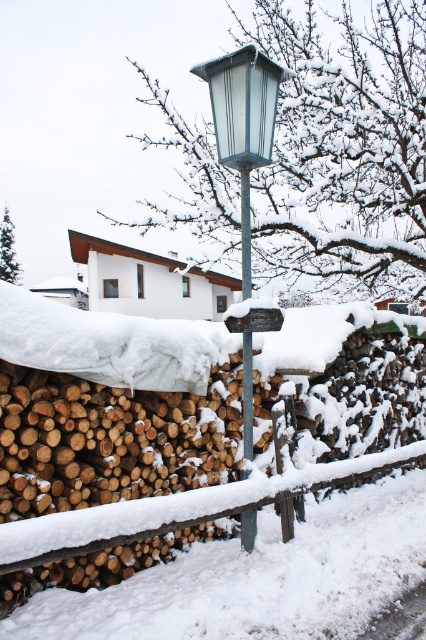
You are standing in the snowy winter scene and want to hang a small decoration on the lowest part of the metallic glass street light at center. To ensure it doesn t fall off, you need to know if the wooden sign at center is below or above the street light. Can you tell me which one is positioned lower?

The metallic glass street light at center is located above the wooden sign at center, so the wooden sign at center is positioned lower.